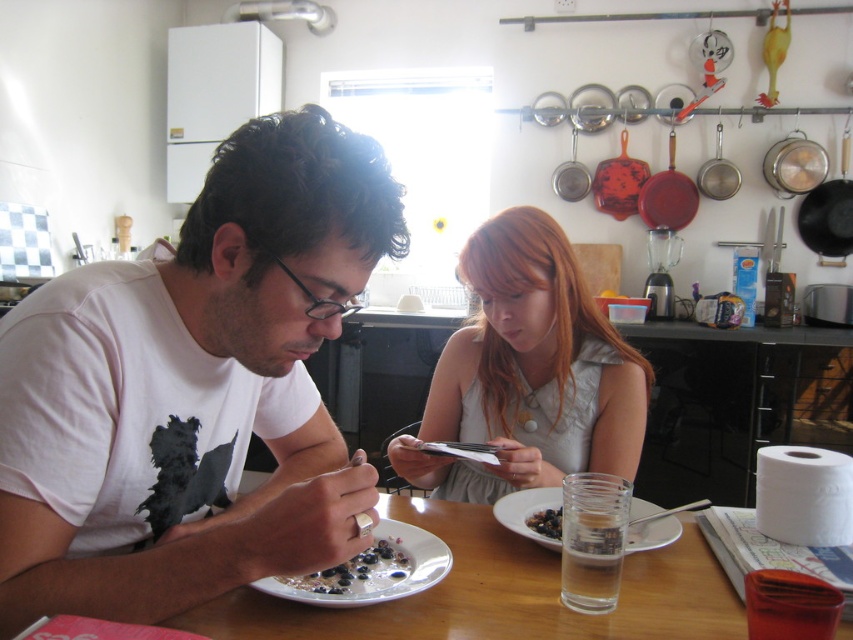
Is wooden table at center to the left of shiny metallic plate with blueberries at center from the viewer's perspective?

Incorrect, wooden table at center is not on the left side of shiny metallic plate with blueberries at center.

Is point (218, 608) behind point (283, 582)?

That is False.

Where is `wooden table at center`? Image resolution: width=853 pixels, height=640 pixels. wooden table at center is located at coordinates (498, 593).

Can you confirm if white matte t-shirt at center is wider than wooden table at center?

No, white matte t-shirt at center is not wider than wooden table at center.

Is point (64, 280) positioned before point (457, 580)?

Yes, point (64, 280) is in front of point (457, 580).

Identify the location of white matte t-shirt at center. (193, 388).

Who is more distant from viewer, (x=402, y=586) or (x=546, y=504)?

Point (x=546, y=504)

Between point (412, 541) and point (633, 545), which one is positioned behind?

Positioned behind is point (633, 545).

The image size is (853, 640). What are the coordinates of `white glossy plate at lower center` in the screenshot? It's located at (370, 570).